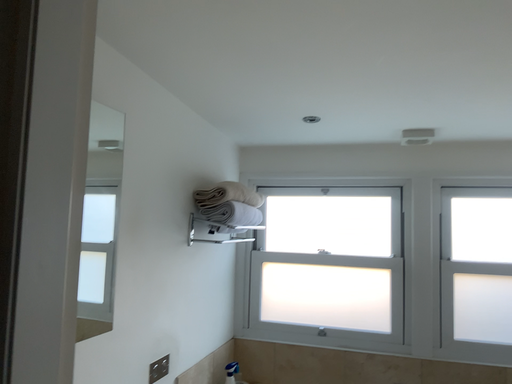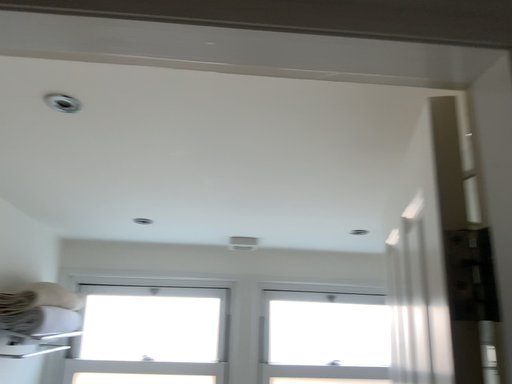
Question: Which way did the camera rotate in the video?

Choices:
 (A) rotated upward
 (B) rotated downward

Answer: (A)